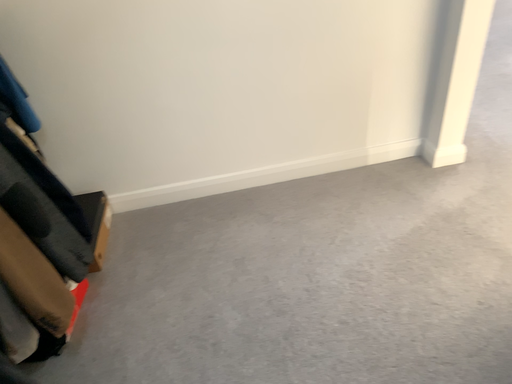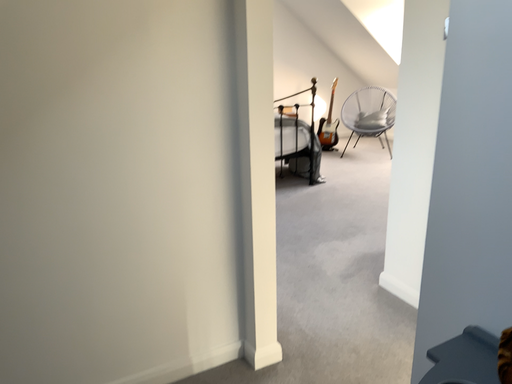
Question: Which way did the camera rotate in the video?

Choices:
 (A) rotated upward
 (B) rotated downward

Answer: (A)